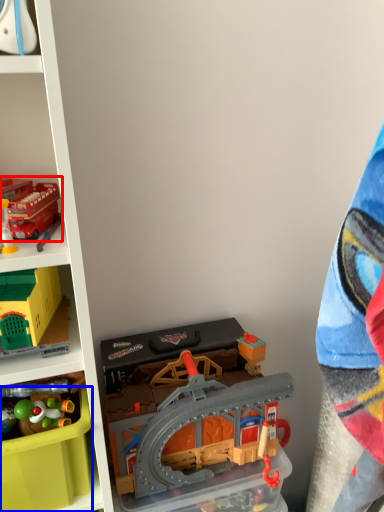
Question: Which point is further to the camera, toy (highlighted by a red box) or storage box (highlighted by a blue box)?

Choices:
 (A) toy
 (B) storage box

Answer: (B)